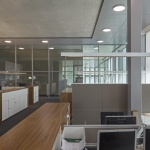
This screenshot has width=150, height=150. I want to click on gray floor, so click(35, 104).